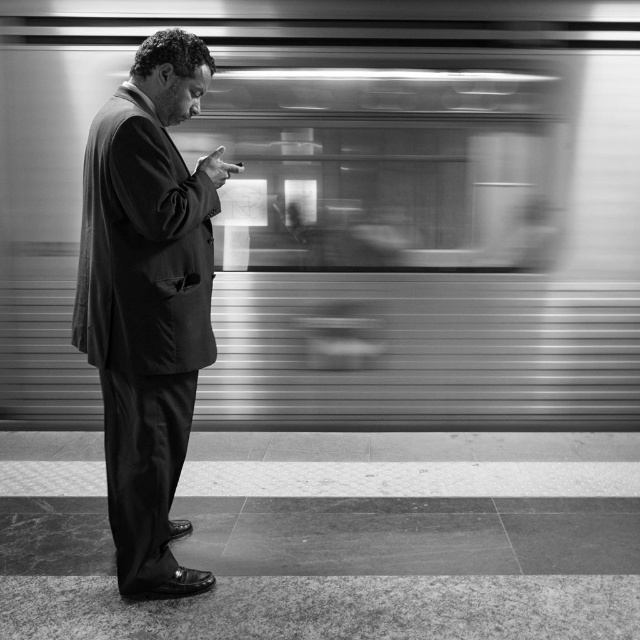
Is metallic silver train at center positioned at the back of smooth suit at center?

Yes, metallic silver train at center is behind smooth suit at center.

Can you confirm if metallic silver train at center is wider than smooth suit at center?

Correct, the width of metallic silver train at center exceeds that of smooth suit at center.

Find the location of a particular element. The height and width of the screenshot is (640, 640). metallic silver train at center is located at coordinates (355, 204).